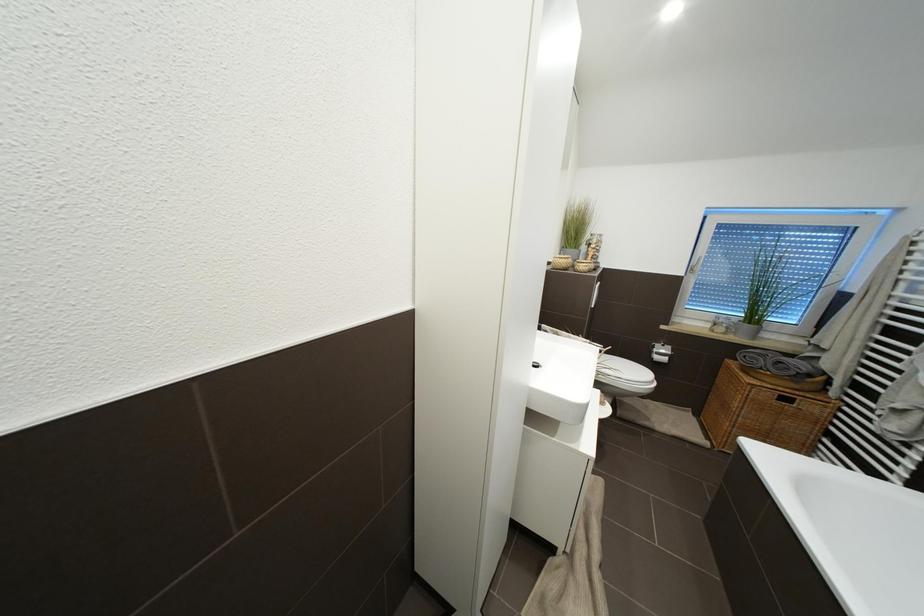
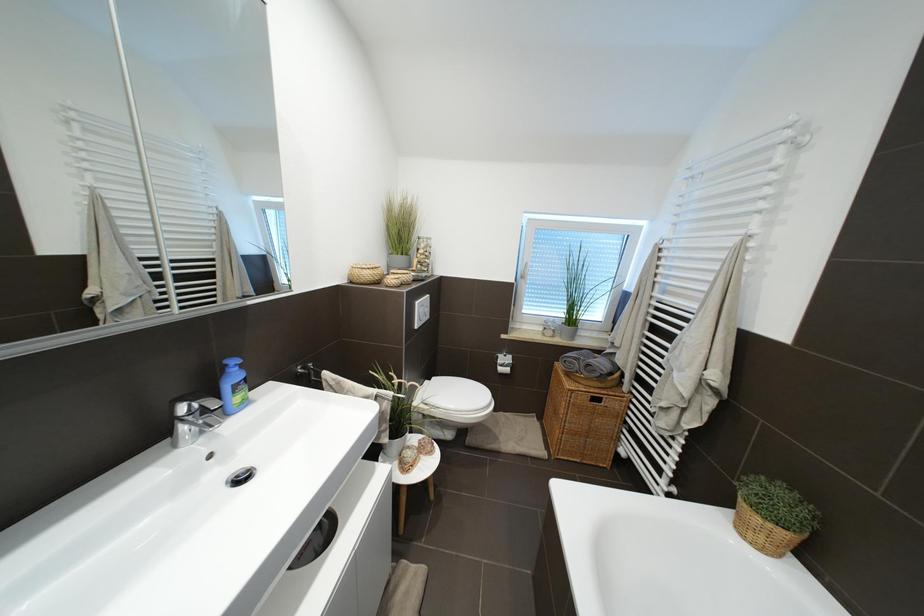
What movement of the cameraman would produce the second image?

The movement direction of the cameraman is right, forward.